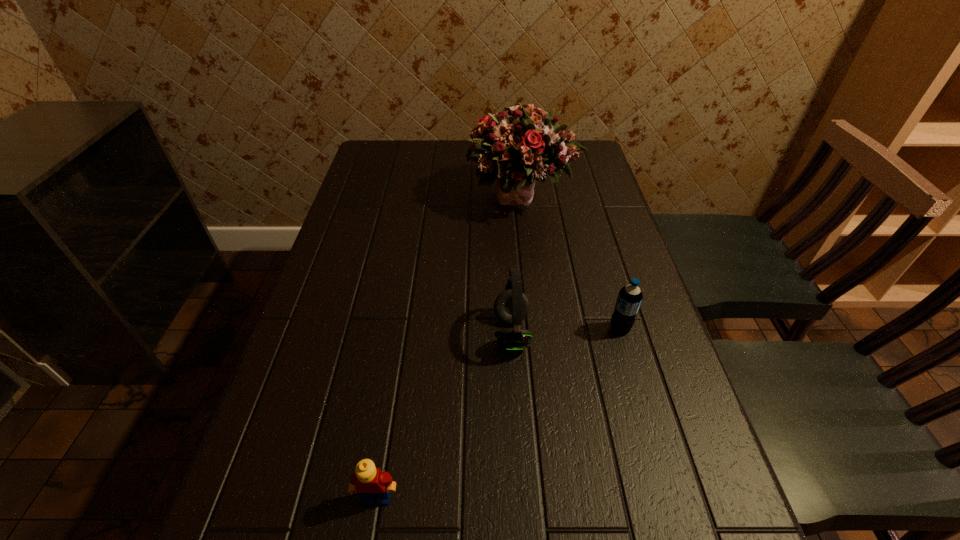
Where is `vacant point located 0.120m on the left of the soda bottle`? vacant point located 0.120m on the left of the soda bottle is located at coordinates (554, 329).

Where is `object present at the far edge`? The image size is (960, 540). object present at the far edge is located at coordinates click(x=521, y=144).

Identify the location of bouquet that is at the right edge. The image size is (960, 540). (521, 144).

At what (x,y) coordinates should I click in order to perform the action: click on soda bottle present at the right edge. Please return your answer as a coordinate pair (x, y). Looking at the image, I should click on (629, 299).

Locate an element on the screen. This screenshot has width=960, height=540. object located in the far right corner section of the desktop is located at coordinates (521, 144).

In the image, there is a desktop. Identify the location of vacant region at the far edge. This screenshot has height=540, width=960. (466, 168).

This screenshot has width=960, height=540. I want to click on free space at the left edge, so click(387, 227).

In the image, there is a desktop. What are the coordinates of `free space at the right edge` in the screenshot? It's located at (636, 276).

Where is `vacant area at the far left corner`? The height and width of the screenshot is (540, 960). vacant area at the far left corner is located at coordinates (369, 145).

Where is `free space between the soda bottle and the tallest object`? free space between the soda bottle and the tallest object is located at coordinates (571, 263).